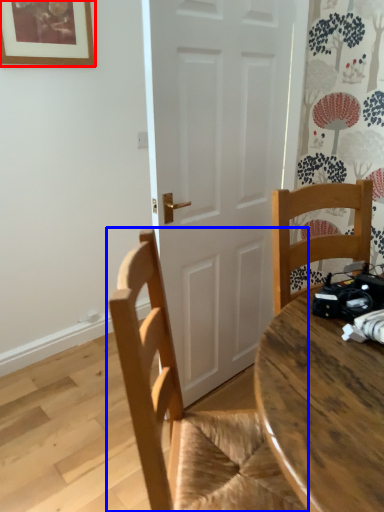
Question: Which object appears closest to the camera in this image, picture frame (highlighted by a red box) or chair (highlighted by a blue box)?

Choices:
 (A) picture frame
 (B) chair

Answer: (B)